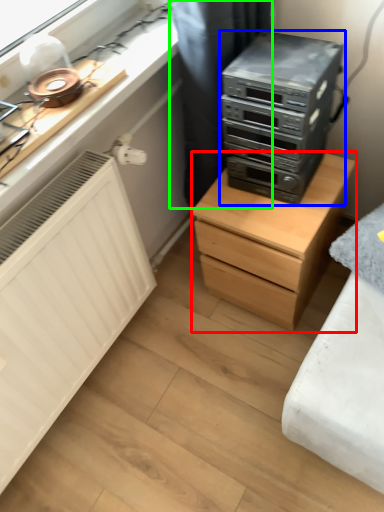
Question: Estimate the real-world distances between objects in this image. Which object is closer to chest of drawers (highlighted by a red box), home appliance (highlighted by a blue box) or curtain (highlighted by a green box)?

Choices:
 (A) home appliance
 (B) curtain

Answer: (A)